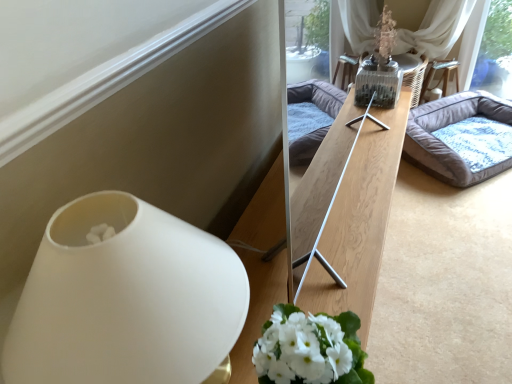
What do you see at coordinates (461, 137) in the screenshot? This screenshot has width=512, height=384. I see `gray fabric pet bed at center` at bounding box center [461, 137].

This screenshot has width=512, height=384. Find the location of `gray fabric pet bed at center`. gray fabric pet bed at center is located at coordinates [461, 137].

What do you see at coordinates (125, 299) in the screenshot? I see `white matte vase at lower left` at bounding box center [125, 299].

This screenshot has height=384, width=512. I want to click on white matte vase at lower left, so click(x=125, y=299).

What is the approximate width of white matte vase at lower left?

white matte vase at lower left is 10.83 inches in width.

What is the approximate height of white matte vase at lower left?

20.55 inches.

The image size is (512, 384). I want to click on gray fabric pet bed at center, so click(461, 137).

Considering the positions of objects white matte vase at lower left and gray fabric pet bed at center in the image provided, who is more to the right, white matte vase at lower left or gray fabric pet bed at center?

gray fabric pet bed at center is more to the right.

In the image, is white matte vase at lower left positioned in front of or behind gray fabric pet bed at center?

In the image, white matte vase at lower left appears in front of gray fabric pet bed at center.

Does point (190, 376) come in front of point (438, 151)?

Yes, it is.

From the image's perspective, is white matte vase at lower left located above gray fabric pet bed at center?

Actually, white matte vase at lower left appears below gray fabric pet bed at center in the image.

From a real-world perspective, who is located higher, white matte vase at lower left or gray fabric pet bed at center?

white matte vase at lower left, from a real-world perspective.

Consider the image. Can you confirm if white matte vase at lower left is wider than gray fabric pet bed at center?

In fact, white matte vase at lower left might be narrower than gray fabric pet bed at center.

Does white matte vase at lower left have a lesser height compared to gray fabric pet bed at center?

No.

Which of these two, white matte vase at lower left or gray fabric pet bed at center, is smaller?

With smaller size is white matte vase at lower left.

Is gray fabric pet bed at center a part of white matte vase at lower left?

That's incorrect, gray fabric pet bed at center is not inside white matte vase at lower left.

Is there a large distance between white matte vase at lower left and gray fabric pet bed at center?

Yes, white matte vase at lower left is far from gray fabric pet bed at center.

Does white matte vase at lower left turn towards gray fabric pet bed at center?

No, white matte vase at lower left is not turned towards gray fabric pet bed at center.

Can you tell me how much white matte vase at lower left and gray fabric pet bed at center differ in facing direction?

The angular difference between white matte vase at lower left and gray fabric pet bed at center is 39 degrees.

How far apart are white matte vase at lower left and gray fabric pet bed at center?

white matte vase at lower left is 6.73 feet away from gray fabric pet bed at center.

This screenshot has height=384, width=512. Find the location of `studio couch above the white matte vase at lower left (from the image's perspective)`. studio couch above the white matte vase at lower left (from the image's perspective) is located at coordinates coord(461,137).

Would you say gray fabric pet bed at center is to the left or to the right of white matte vase at lower left in the picture?

In the image, gray fabric pet bed at center appears on the right side of white matte vase at lower left.

Considering the relative positions of gray fabric pet bed at center and white matte vase at lower left in the image provided, is gray fabric pet bed at center behind white matte vase at lower left?

Yes, gray fabric pet bed at center is further from the viewer.

Considering the points (508, 131) and (164, 305), which point is behind, point (508, 131) or point (164, 305)?

The point (508, 131) is farther from the camera.

From the image's perspective, would you say gray fabric pet bed at center is positioned over white matte vase at lower left?

Yes, from the image's perspective, gray fabric pet bed at center is above white matte vase at lower left.

From a real-world perspective, which is physically below, gray fabric pet bed at center or white matte vase at lower left?

gray fabric pet bed at center.

Consider the image. Is gray fabric pet bed at center wider or thinner than white matte vase at lower left?

Clearly, gray fabric pet bed at center has more width compared to white matte vase at lower left.

Considering the relative sizes of gray fabric pet bed at center and white matte vase at lower left in the image provided, is gray fabric pet bed at center taller than white matte vase at lower left?

In fact, gray fabric pet bed at center may be shorter than white matte vase at lower left.

Which of these two, gray fabric pet bed at center or white matte vase at lower left, is bigger?

With larger size is gray fabric pet bed at center.

Is gray fabric pet bed at center inside or outside of white matte vase at lower left?

gray fabric pet bed at center is located beyond the bounds of white matte vase at lower left.

Is gray fabric pet bed at center not near white matte vase at lower left?

That's right, there is a large distance between gray fabric pet bed at center and white matte vase at lower left.

Is gray fabric pet bed at center facing away from white matte vase at lower left?

gray fabric pet bed at center is not turned away from white matte vase at lower left.

Can you tell me how much gray fabric pet bed at center and white matte vase at lower left differ in facing direction?

39 degrees.

What are the coordinates of `studio couch above the white matte vase at lower left (from the image's perspective)` in the screenshot? It's located at pos(461,137).

Image resolution: width=512 pixels, height=384 pixels. In order to click on vase below the gray fabric pet bed at center (from the image's perspective) in this screenshot , I will do `click(125, 299)`.

The width and height of the screenshot is (512, 384). I want to click on vase lying in front of the gray fabric pet bed at center, so click(x=125, y=299).